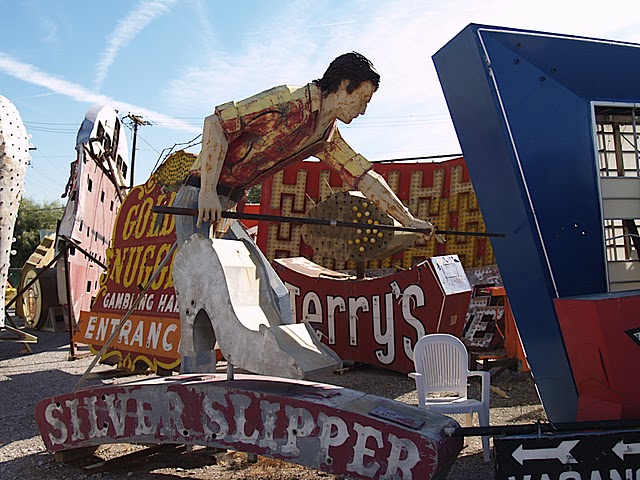
Locate an element on the screen. This screenshot has width=640, height=480. shoe is located at coordinates (260, 309).